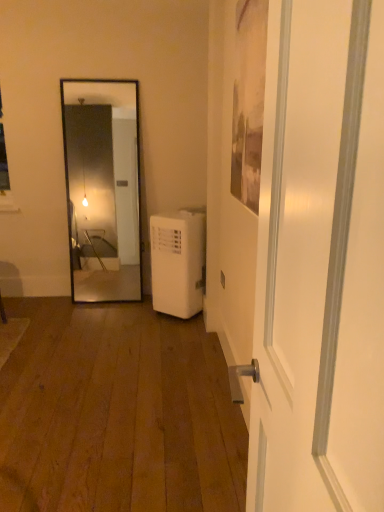
Question: From their relative heights in the image, would you say white glossy door at center is taller or shorter than white plastic air conditioner at lower right?

Choices:
 (A) short
 (B) tall

Answer: (B)

Question: Visually, is white glossy door at center positioned to the left or to the right of white plastic air conditioner at lower right?

Choices:
 (A) right
 (B) left

Answer: (A)

Question: Is white glossy door at center inside or outside of white plastic air conditioner at lower right?

Choices:
 (A) inside
 (B) outside

Answer: (B)

Question: Considering their positions, is white plastic air conditioner at lower right located in front of or behind white glossy door at center?

Choices:
 (A) behind
 (B) front

Answer: (A)

Question: In terms of width, does white plastic air conditioner at lower right look wider or thinner when compared to white glossy door at center?

Choices:
 (A) thin
 (B) wide

Answer: (B)

Question: From the image's perspective, is white plastic air conditioner at lower right positioned above or below white glossy door at center?

Choices:
 (A) above
 (B) below

Answer: (A)

Question: Is white plastic air conditioner at lower right bigger or smaller than white glossy door at center?

Choices:
 (A) small
 (B) big

Answer: (B)